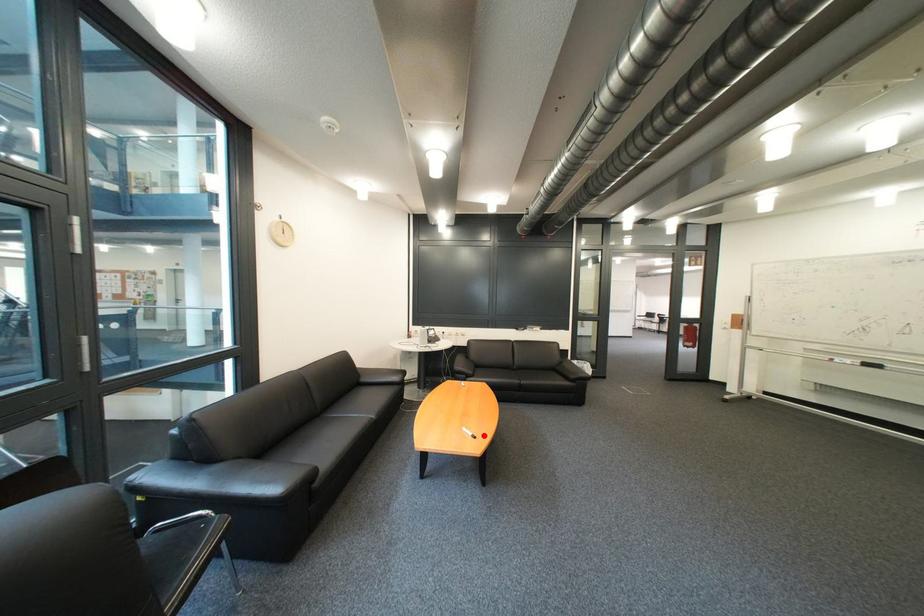
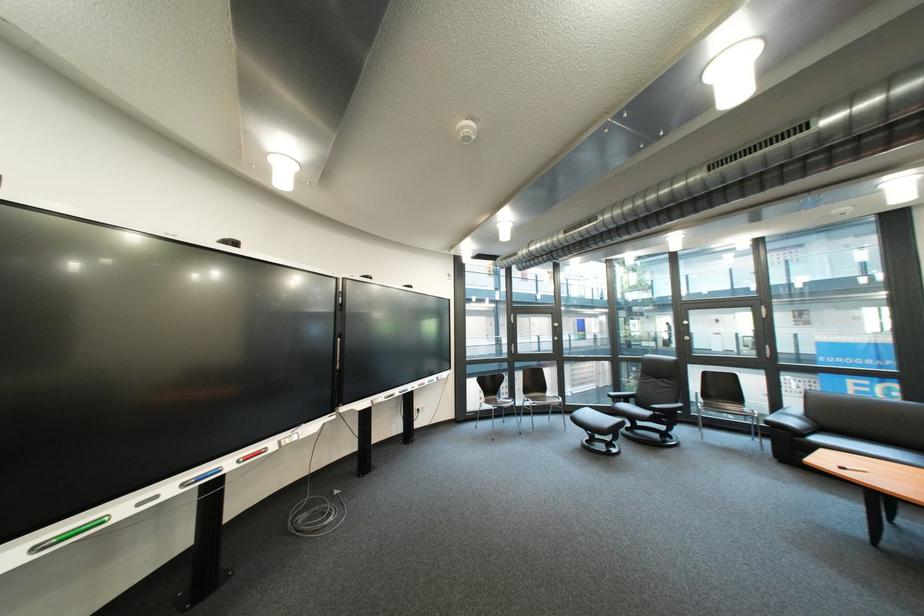
Where in the second image is the point corresponding to the highlighted location from the first image?

(862, 469)